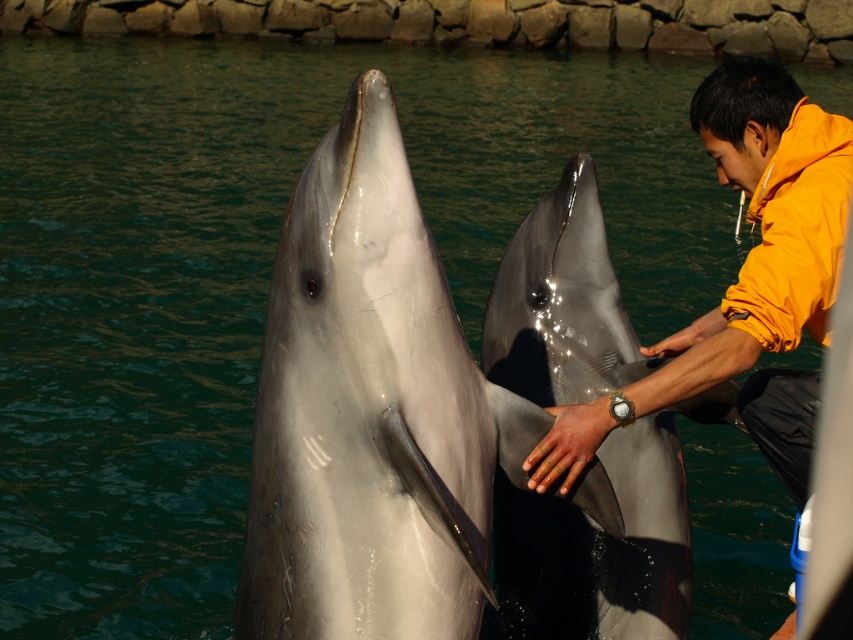
You are a marine biologist observing the interaction between the white glossy dolphin at center and the yellow fleece jacket at right. From the observer perspective, which object is positioned to the left?

The white glossy dolphin at center is positioned to the left of the yellow fleece jacket at right.

You are a marine biologist observing the scene. You need to determine if you can safely place a 3.5 feet long measuring tape between the white glossy dolphin at center and the yellow fleece jacket at right without disturbing them. Is it possible?

The white glossy dolphin at center and the yellow fleece jacket at right are 3.49 feet apart. Since the measuring tape is 3.5 feet long, it is slightly longer than the distance between them. Therefore, placing the measuring tape between them would not be possible without overlapping or disturbing the animals.